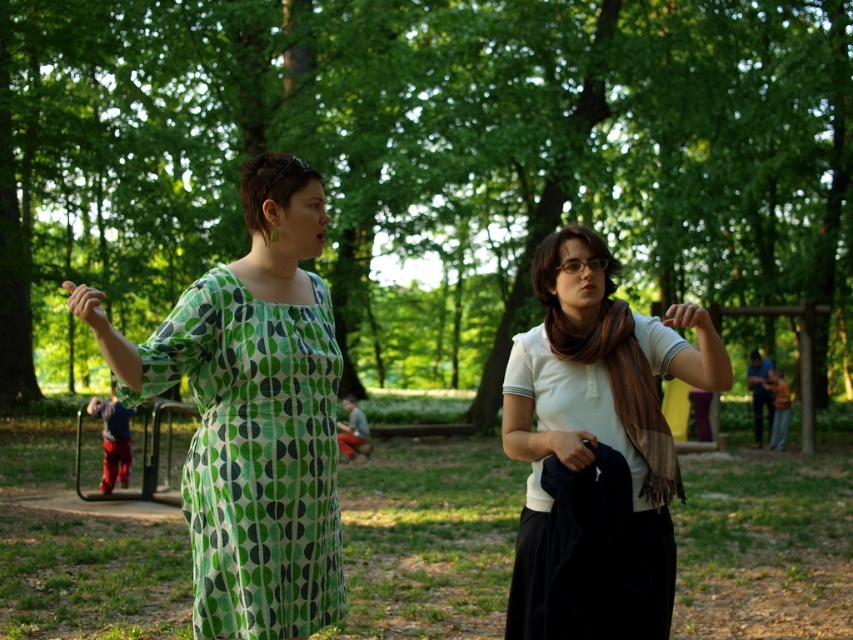
From the picture: Two women are talking in a park. The woman on the left is wearing a green dotted fabric dress at center. The woman on the right is wearing a different outfit. How far apart are they?

They are 13.88 feet apart.

You are standing in the park and see two people wearing the green dotted fabric dress at center and the white cotton shirt at center. Which clothing item is shorter in height?

The green dotted fabric dress at center is not as tall as the white cotton shirt at center, so the green dotted fabric dress at center is shorter in height.

You are a photographer setting up for a group photo. You notice two clothing items in the scene, the green dotted fabric dress at center and the white cotton shirt at center. Which clothing item takes up less space in the photo?

The green dotted fabric dress at center is smaller than the white cotton shirt at center, so it takes up less space in the photo.